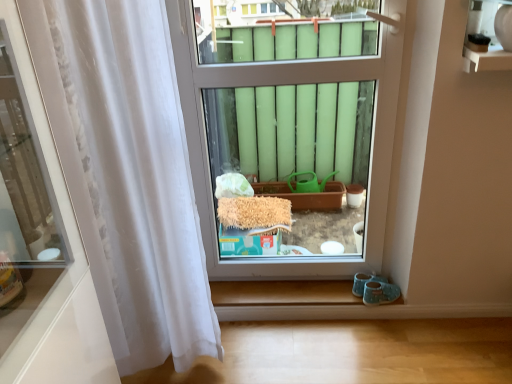
Where is `vacant space underneath transparent glass window at center (from a real-world perspective)`? The width and height of the screenshot is (512, 384). vacant space underneath transparent glass window at center (from a real-world perspective) is located at coordinates (x=296, y=286).